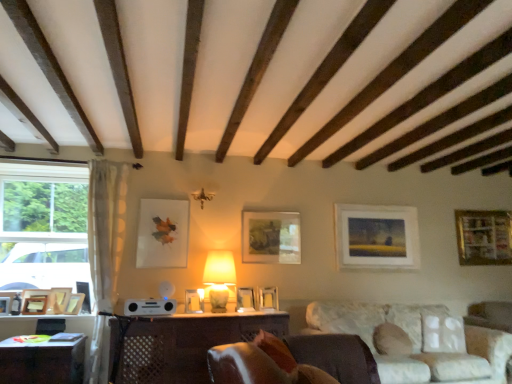
Image resolution: width=512 pixels, height=384 pixels. Identify the location of empty space that is ontop of wooden picture frame at right, the twelfth picture frame in the left-to-right sequence (from a real-world perspective). [476, 210].